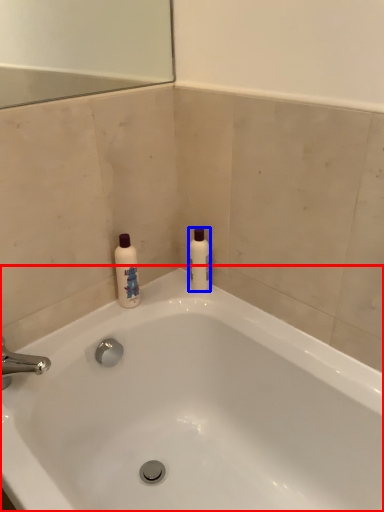
Question: Among these objects, which one is farthest to the camera, bathtub (highlighted by a red box) or cleaning product (highlighted by a blue box)?

Choices:
 (A) bathtub
 (B) cleaning product

Answer: (B)